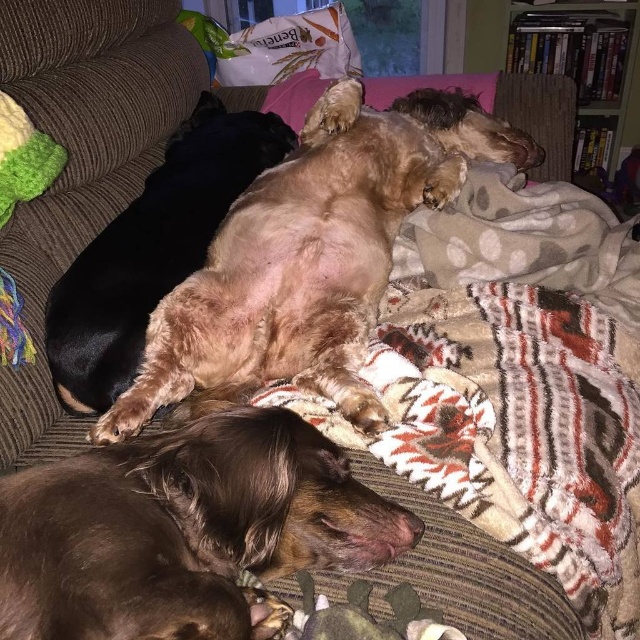
You are a photographer taking a picture of the two dogs on the couch. Which dog will appear larger in the photo, the fuzzy brown dog at center or the light brown fur at center?

The fuzzy brown dog at center will appear larger in the photo because it is closer to the viewer than the light brown fur at center.

You are trying to place a new pillow on the couch. The pillow is 12 inches wide. You see the light brown fur at center and the green fuzzy toy at left. Which object should you move to make space, and why?

You should move the light brown fur at center because its width surpasses the green fuzzy toy at left, meaning it occupies more space. Moving the larger object will create more room for the pillow.

In the scene shown: You are a photographer trying to capture both the light brown fur at center and the green fuzzy toy at left in a single shot. Which object should you focus on first to ensure both are in the frame?

You should focus on the light brown fur at center first because it is closer to you than the green fuzzy toy at left, so adjusting the camera to include it will naturally include the farther object as well.